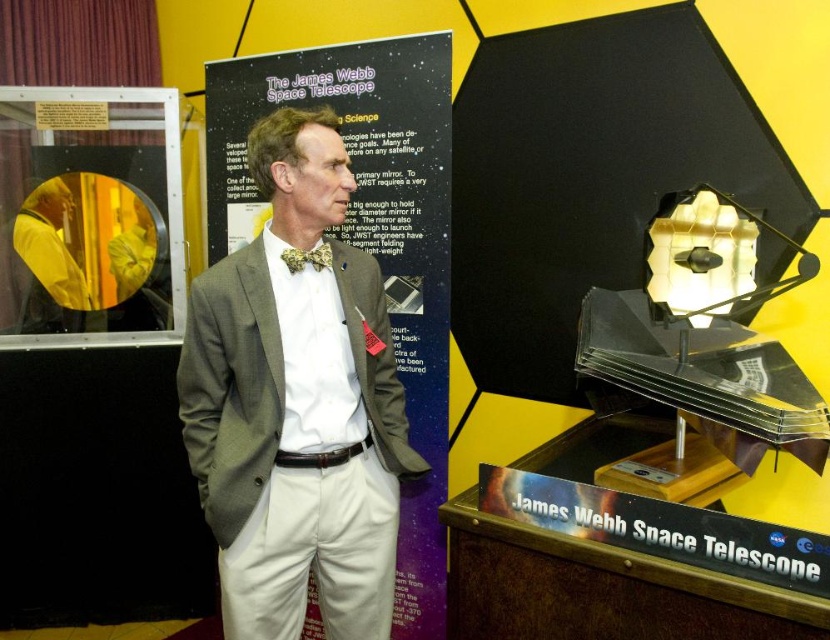
Question: Which point appears farthest from the camera in this image?

Choices:
 (A) (345, 364)
 (B) (323, 257)
 (C) (54, 204)

Answer: (C)

Question: Which point appears farthest from the camera in this image?

Choices:
 (A) (46, 262)
 (B) (293, 268)
 (C) (238, 570)

Answer: (A)

Question: Is gray textured suit at center positioned in front of yellow fabric at center?

Choices:
 (A) no
 (B) yes

Answer: (B)

Question: Does gray textured suit at center have a larger size compared to floral silk bow tie at center?

Choices:
 (A) yes
 (B) no

Answer: (A)

Question: Which of the following is the closest to the observer?

Choices:
 (A) floral silk bow tie at center
 (B) yellow fabric at center

Answer: (A)

Question: Does gray textured suit at center appear under floral silk bow tie at center?

Choices:
 (A) no
 (B) yes

Answer: (B)